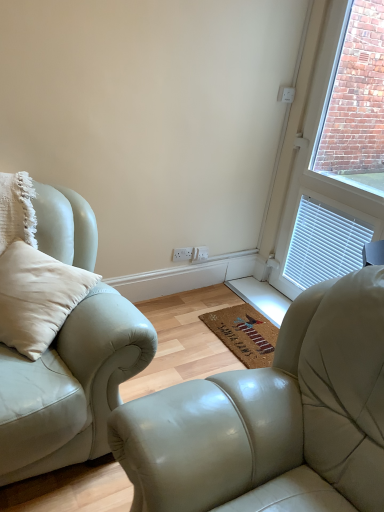
Question: In the image, is light beige leather couch at left positioned in front of or behind white plastic electric outlet at center?

Choices:
 (A) front
 (B) behind

Answer: (A)

Question: From the image's perspective, is light beige leather couch at left positioned above or below white plastic electric outlet at center?

Choices:
 (A) below
 (B) above

Answer: (A)

Question: Estimate the real-world distances between objects in this image. Which object is farther from the white plastic electric outlet at center?

Choices:
 (A) light beige leather couch at left
 (B) coir mat at center
 (C) white textured window at upper right

Answer: (A)

Question: Which is nearer to the coir mat at center?

Choices:
 (A) white textured window at upper right
 (B) light beige leather couch at left
 (C) white plastic electric outlet at center

Answer: (C)